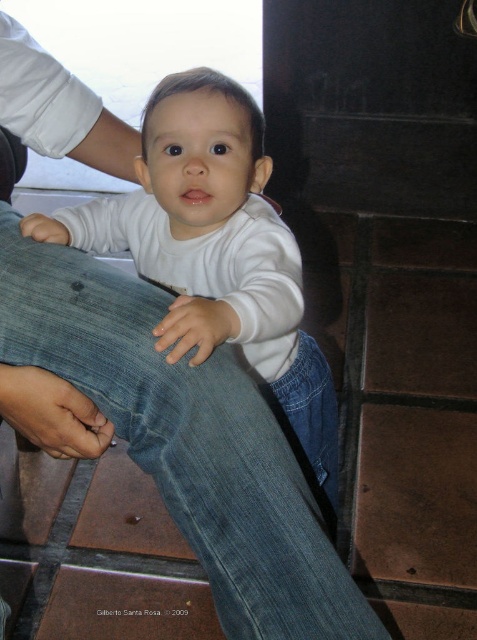
You are a photographer adjusting your camera settings to focus on the denim jeans at lower left and the white matte shirt at center. Which object should you focus on first to ensure proper depth of field?

The denim jeans at lower left should be focused on first because it is closer to the viewer than the white matte shirt at center, ensuring the depth of field captures both objects clearly.

In the scene shown: You are a photographer setting up for a baby photo shoot. You need to ensure the denim jeans at lower left and the white matte shirt at center are visible in the frame. Based on their positions, which object should you focus on first to capture both in the shot?

The denim jeans at lower left is positioned under the white matte shirt at center, so focusing on the white matte shirt at center first will ensure both objects are in the frame since the jeans are below it.

You are a tailor measuring fabric widths for a project. You have a piece of fabric that is 10 cm wide. You need to choose between the denim jeans at lower left and the white matte shirt at center. Which item can the fabric fit through a narrow gap if the gap is exactly the width of the fabric?

The denim jeans at lower left is thinner than the white matte shirt at center, so the fabric can fit through the gap if using the denim jeans at lower left since it is thinner and requires less width.